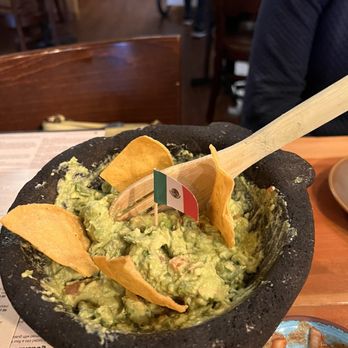
Locate an element on the screen. chair is located at coordinates (57, 82).